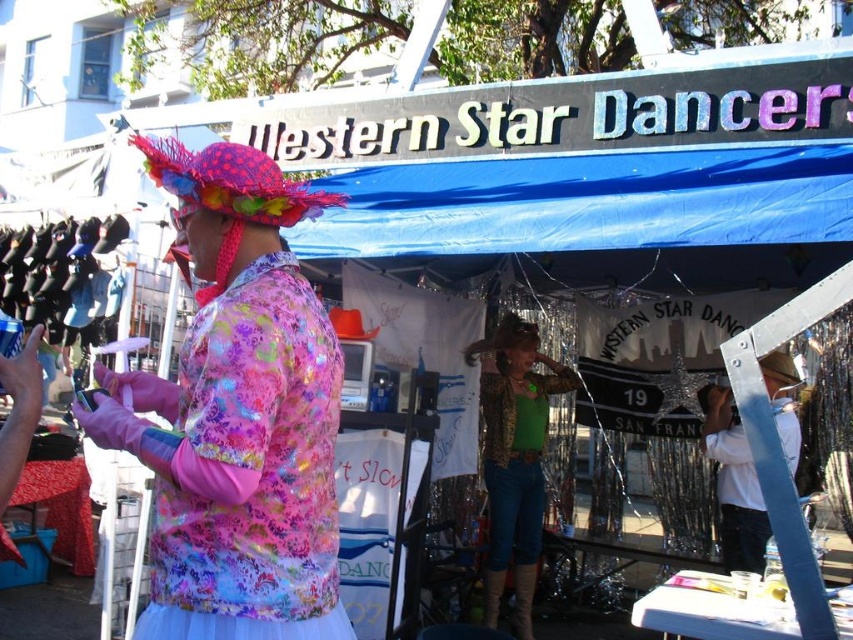
You are a photographer at the festival and want to capture both the leopard print jacket at center and the white cotton shirt at center in the same frame. Which jacket should you focus on first if you want to ensure both are in the shot?

The leopard print jacket at center is positioned on the left side of white cotton shirt at center, so focusing on the leopard print jacket at center first will help ensure both are captured in the frame.

You are a photographer at the festival and need to capture a photo of both the leopard print jacket at center and the white cotton shirt at center. Since you want them to appear balanced in the frame, which clothing item should you position closer to the camera to make them look similar in size?

The leopard print jacket at center is wider than the white cotton shirt at center, so to balance their sizes in the photo, position the white cotton shirt at center closer to the camera.